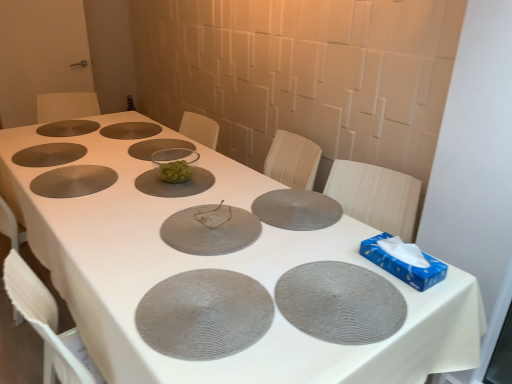
At what (x,y) coordinates should I click in order to perform the action: click on free space above clear glass bowl at center, acting as the 5th glass plate starting from the back (from a real-world perspective). Please return your answer as a coordinate pair (x, y). This screenshot has height=384, width=512. Looking at the image, I should click on (169, 180).